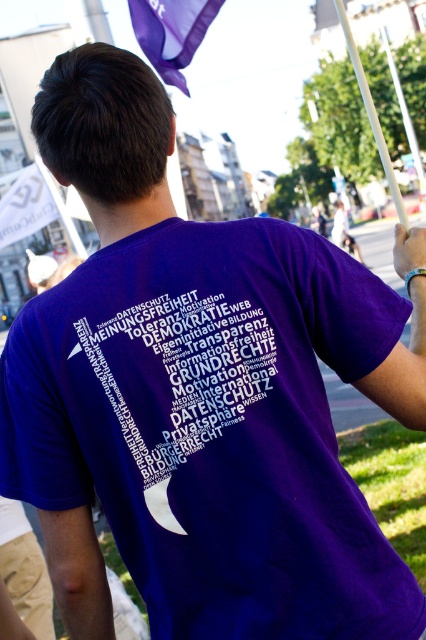
At what (x,y) coordinates should I click in order to perform the action: click on purple fabric shirt at back. Please return your answer as a coordinate pair (x, y). Looking at the image, I should click on pos(181,376).